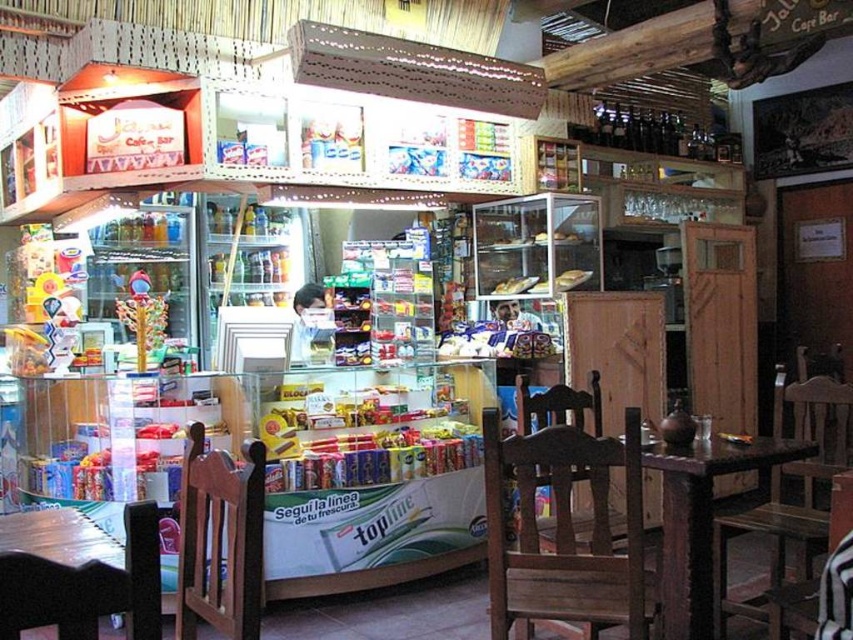
You are a customer in the cafe and want to sit at the dark brown wooden table at center. You see the wooden chair at lower left. Is the chair tall enough to use with the table?

The wooden chair at lower left is shorter than the dark brown wooden table at center, so the chair may not be tall enough to comfortably use with the table.

You are a customer at the counter in the small cafe. You notice two points on the counter. One is at coordinate point [149,513] and the other is at coordinate point [761,493]. Which point is closer to you?

Answer: Point [149,513] is closer to you than point [761,493].